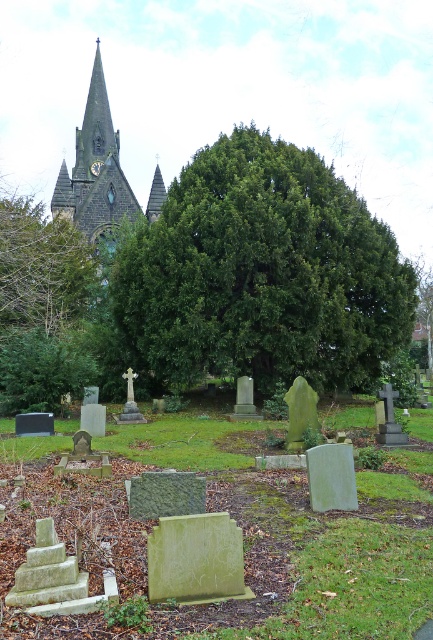
You are standing in the cemetery looking towards the church. You notice a green leafy tree at upper left and a smooth stone church steeple at upper left. Which object appears narrower from your perspective?

The green leafy tree at upper left appears narrower than the smooth stone church steeple at upper left.

You are standing in the cemetery and want to take a photo of the smooth stone church steeple at upper left. If your camera has a maximum focus range of 100 meters, will you be able to capture it clearly?

The smooth stone church steeple at upper left is 107.46 meters away from the viewer. Since the camera can only focus up to 100 meters, you won the clear photo.